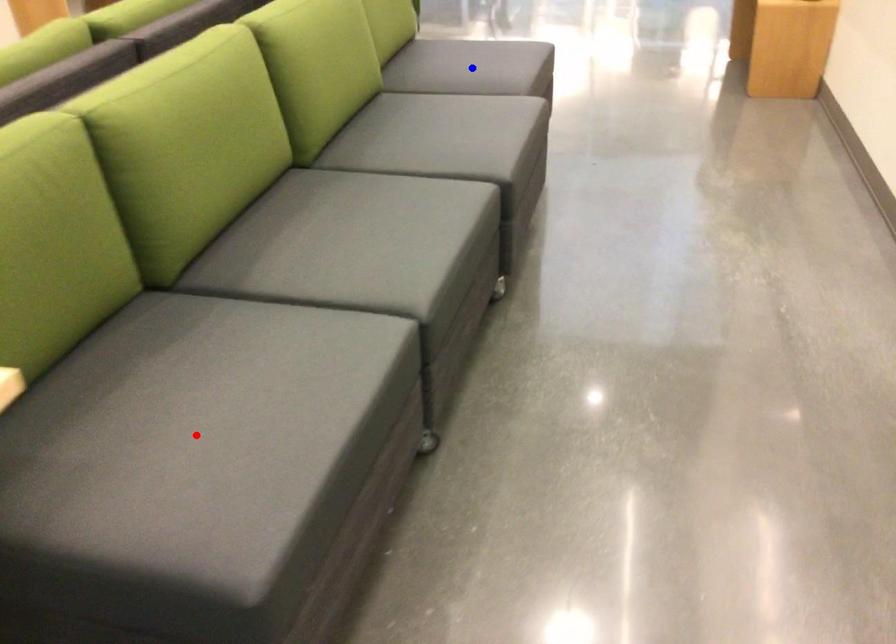
Question: Which of the two points in the image is closer to the camera?

Choices:
 (A) Blue point is closer.
 (B) Red point is closer.

Answer: (B)